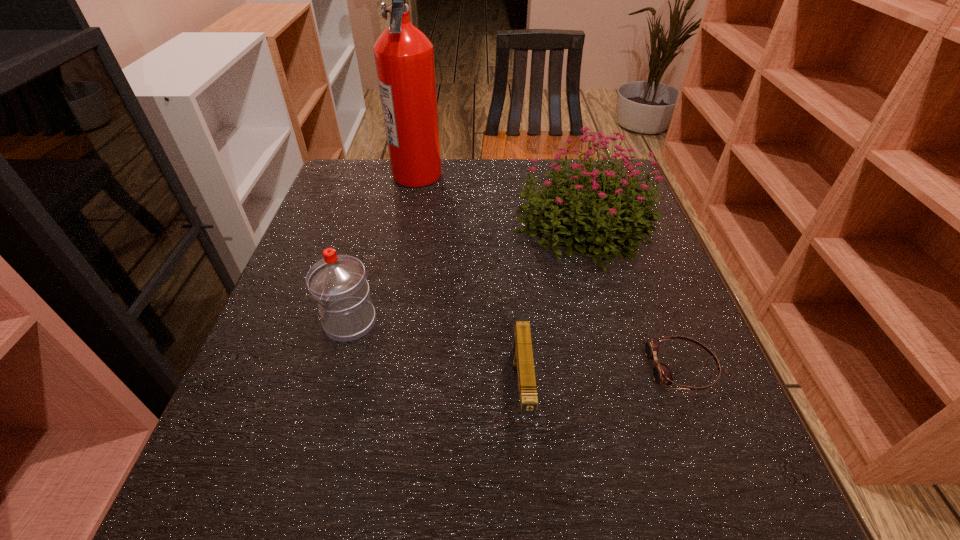
The height and width of the screenshot is (540, 960). I want to click on empty space between the fire extinguisher and the fourth tallest object, so click(x=469, y=283).

Identify the location of empty space between the water bottle and the second tallest object. (466, 275).

At what (x,y) coordinates should I click in order to perform the action: click on blank region between the fire extinguisher and the bouquet. Please return your answer as a coordinate pair (x, y). The image size is (960, 540). Looking at the image, I should click on (499, 201).

Where is `object that stands as the second closest to the shortest object`? This screenshot has width=960, height=540. object that stands as the second closest to the shortest object is located at coordinates (522, 354).

Identify which object is the fourth nearest to the goggles. Please provide its 2D coordinates. Your answer should be formatted as a tuple, i.e. [(x, y)], where the tuple contains the x and y coordinates of a point satisfying the conditions above.

[(404, 56)]

You are a GUI agent. You are given a task and a screenshot of the screen. Output one action in this format:
    pyautogui.click(x=<x>, y=<y>)
    Task: Click on the vacant space that satisfies the following two spatial constraints: 1. at the nozzle of the second tallest object; 2. on the left side of the fire extinguisher
    The image size is (960, 540).
    Given the screenshot: What is the action you would take?
    pyautogui.click(x=407, y=228)

Image resolution: width=960 pixels, height=540 pixels. In order to click on blank space that satisfies the following two spatial constraints: 1. through the lenses of the shortest object; 2. at the barrel of the second shortest object in this screenshot , I will do `click(691, 392)`.

Find the location of a particular element. free space in the image that satisfies the following two spatial constraints: 1. at the nozzle of the tallest object; 2. on the back side of the fourth shortest object is located at coordinates (407, 228).

The height and width of the screenshot is (540, 960). Find the location of `vacant space that satisfies the following two spatial constraints: 1. through the lenses of the goggles; 2. at the barrel of the pistol`. vacant space that satisfies the following two spatial constraints: 1. through the lenses of the goggles; 2. at the barrel of the pistol is located at coordinates (691, 392).

Find the location of a particular element. free space that satisfies the following two spatial constraints: 1. at the nozzle of the tallest object; 2. on the back side of the second tallest object is located at coordinates (407, 228).